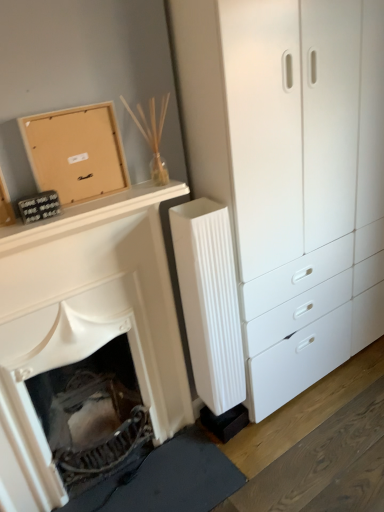
Question: Is white matte fireplace at lower left inside the boundaries of white ribbed radiator at center, or outside?

Choices:
 (A) inside
 (B) outside

Answer: (B)

Question: Considering the positions of white matte fireplace at lower left and white ribbed radiator at center in the image, is white matte fireplace at lower left bigger or smaller than white ribbed radiator at center?

Choices:
 (A) big
 (B) small

Answer: (A)

Question: Based on their relative distances, which object is farther from the white plastic chest of drawers at center-right?

Choices:
 (A) white matte fireplace at lower left
 (B) matte brown cardboard at upper left
 (C) white ribbed radiator at center

Answer: (B)

Question: Considering the real-world distances, which object is closest to the white plastic chest of drawers at center-right?

Choices:
 (A) matte brown cardboard at upper left
 (B) white ribbed radiator at center
 (C) white matte fireplace at lower left

Answer: (B)